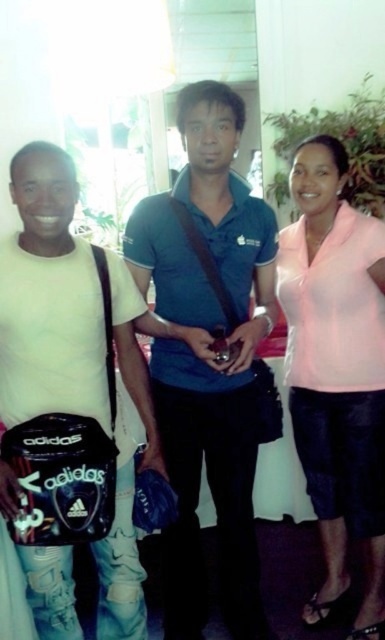
Question: Can you confirm if black matte adidas bag at left is positioned to the right of pink matte shirt at right?

Choices:
 (A) no
 (B) yes

Answer: (A)

Question: Which point is closer to the camera?

Choices:
 (A) blue cotton polo shirt at center
 (B) pink matte shirt at right
 (C) black matte adidas bag at left

Answer: (C)

Question: Which object is closer to the camera taking this photo?

Choices:
 (A) blue cotton polo shirt at center
 (B) black matte adidas bag at left

Answer: (B)

Question: Which point is closer to the camera?

Choices:
 (A) blue cotton polo shirt at center
 (B) black matte adidas bag at left

Answer: (B)

Question: Does blue cotton polo shirt at center come behind pink matte shirt at right?

Choices:
 (A) no
 (B) yes

Answer: (A)

Question: Does blue cotton polo shirt at center appear over black matte adidas bag at left?

Choices:
 (A) no
 (B) yes

Answer: (B)